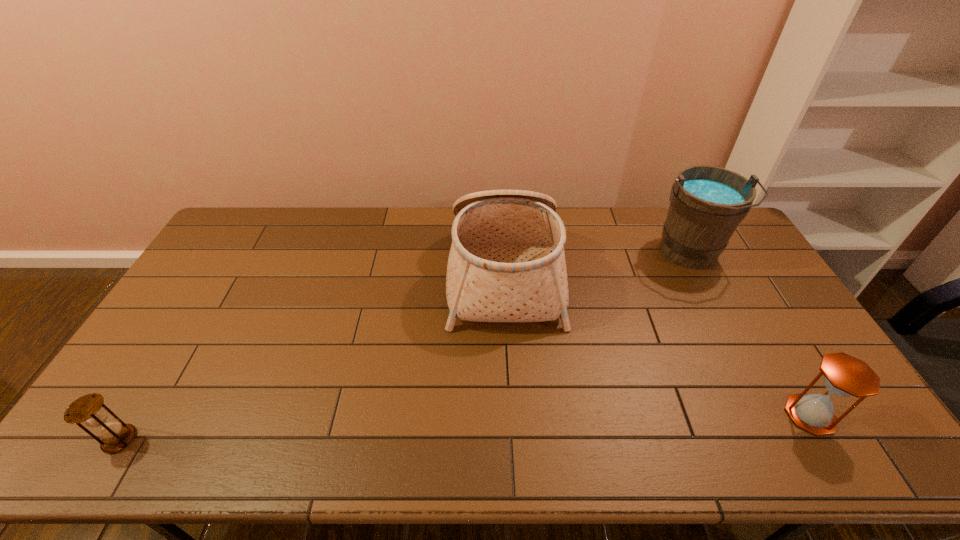
Find the location of a particular element. Image resolution: width=960 pixels, height=540 pixels. vacant space that satisfies the following two spatial constraints: 1. with a handle on the side of the wine bucket; 2. with the lid open on the second object from left to right is located at coordinates (698, 272).